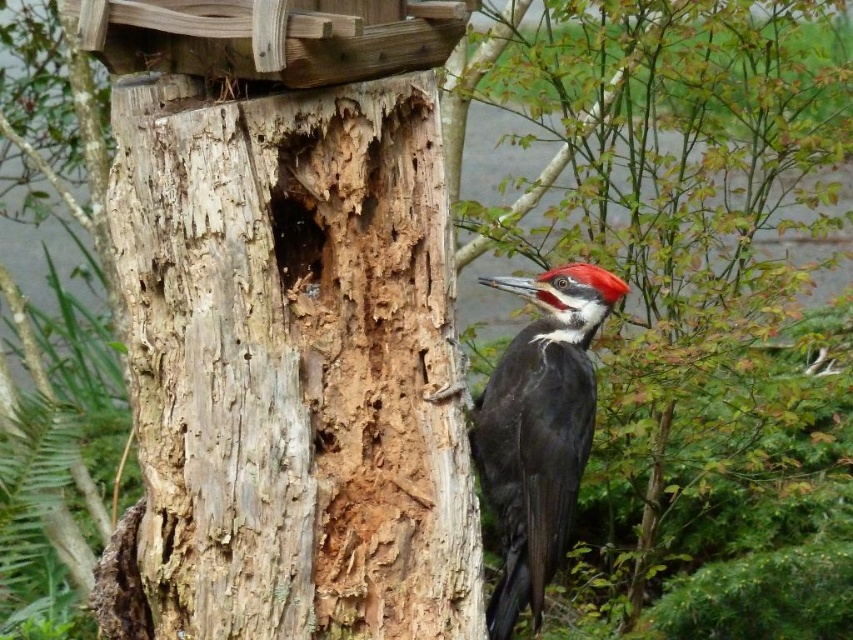
You are a birdwatcher standing in a forest and see the black glossy woodpecker at center. If you want to take a photo of it without disturbing it, what is the minimum distance you should maintain?

The minimum distance you should maintain is 7.89 feet to avoid disturbing the black glossy woodpecker at center, as that is the current distance between you and the bird.

You are a birdwatcher with a camera that has a minimum focusing distance of 10 inches. You want to take a clear photo of the black glossy woodpecker at center while standing at the weathered wood tree trunk at center. Can you get a sharp image without moving closer than your camera allows?

The weathered wood tree trunk at center is 11.40 inches from the black glossy woodpecker at center. Since your camera has a minimum focusing distance of 10 inches, you can take a clear photo as the distance is within the camera range.